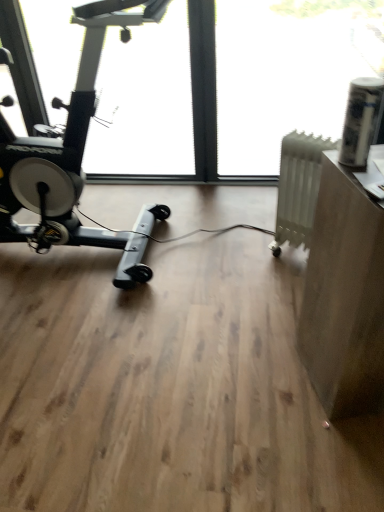
Question: From their relative heights in the image, would you say matte brown desk at right is taller or shorter than transparent plastic window screen at upper right, which appears as the 1th window screen when viewed from the right?

Choices:
 (A) tall
 (B) short

Answer: (B)

Question: Based on their positions, is matte brown desk at right located to the left or right of transparent plastic window screen at upper right, which appears as the 1th window screen when viewed from the right?

Choices:
 (A) left
 (B) right

Answer: (B)

Question: Estimate the real-world distances between objects in this image. Which object is closer to the white matte radiator at right?

Choices:
 (A) transparent glass window at center, the 2th window screen when ordered from right to left
 (B) matte brown desk at right
 (C) transparent plastic window screen at upper right, which appears as the 1th window screen when viewed from the right

Answer: (B)

Question: Estimate the real-world distances between objects in this image. Which object is farther from the matte brown desk at right?

Choices:
 (A) white matte radiator at right
 (B) transparent plastic window screen at upper right, the second window screen when ordered from left to right
 (C) transparent glass window at center, which is the first window screen from left to right

Answer: (B)